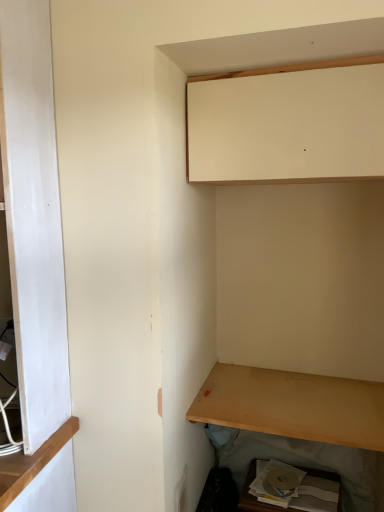
Question: Considering the relative sizes of matte white cabinet at upper center, the 1th cabinetry viewed from the top, and matte cardboard box at lower right, placed as the 1th cabinetry when sorted from bottom to top, in the image provided, is matte white cabinet at upper center, the 1th cabinetry viewed from the top, shorter than matte cardboard box at lower right, placed as the 1th cabinetry when sorted from bottom to top,?

Choices:
 (A) no
 (B) yes

Answer: (A)

Question: Can you confirm if matte white cabinet at upper center, the 1th cabinetry viewed from the top, is wider than matte cardboard box at lower right, acting as the 2th cabinetry starting from the top?

Choices:
 (A) no
 (B) yes

Answer: (B)

Question: From the image's perspective, is matte white cabinet at upper center, the 1th cabinetry viewed from the top, located beneath matte cardboard box at lower right, placed as the 1th cabinetry when sorted from bottom to top?

Choices:
 (A) no
 (B) yes

Answer: (A)

Question: Is matte white cabinet at upper center, the 1th cabinetry viewed from the top, located outside matte cardboard box at lower right, placed as the 1th cabinetry when sorted from bottom to top?

Choices:
 (A) yes
 (B) no

Answer: (A)

Question: Does matte white cabinet at upper center, which is the second cabinetry in bottom-to-top order, appear on the right side of matte cardboard box at lower right, placed as the 1th cabinetry when sorted from bottom to top?

Choices:
 (A) no
 (B) yes

Answer: (A)

Question: In terms of size, does light brown wood shelf at lower right appear bigger or smaller than matte cardboard box at lower right, acting as the 2th cabinetry starting from the top?

Choices:
 (A) big
 (B) small

Answer: (B)

Question: Is light brown wood shelf at lower right inside the boundaries of matte cardboard box at lower right, placed as the 1th cabinetry when sorted from bottom to top, or outside?

Choices:
 (A) inside
 (B) outside

Answer: (B)

Question: From a real-world perspective, is light brown wood shelf at lower right positioned above or below matte cardboard box at lower right, placed as the 1th cabinetry when sorted from bottom to top?

Choices:
 (A) above
 (B) below

Answer: (A)

Question: Based on their positions, is light brown wood shelf at lower right located to the left or right of matte cardboard box at lower right, acting as the 2th cabinetry starting from the top?

Choices:
 (A) right
 (B) left

Answer: (B)

Question: Relative to matte white cabinet at upper center, the 1th cabinetry viewed from the top, is matte cardboard box at lower right, acting as the 2th cabinetry starting from the top, in front or behind?

Choices:
 (A) front
 (B) behind

Answer: (B)

Question: Is matte cardboard box at lower right, placed as the 1th cabinetry when sorted from bottom to top, situated inside matte white cabinet at upper center, which is the second cabinetry in bottom-to-top order, or outside?

Choices:
 (A) outside
 (B) inside

Answer: (A)

Question: In terms of width, does matte cardboard box at lower right, acting as the 2th cabinetry starting from the top, look wider or thinner when compared to matte white cabinet at upper center, the 1th cabinetry viewed from the top?

Choices:
 (A) wide
 (B) thin

Answer: (B)

Question: In terms of size, does matte cardboard box at lower right, acting as the 2th cabinetry starting from the top, appear bigger or smaller than matte white cabinet at upper center, which is the second cabinetry in bottom-to-top order?

Choices:
 (A) small
 (B) big

Answer: (A)

Question: Considering the positions of point (193, 417) and point (382, 117), is point (193, 417) closer or farther from the camera than point (382, 117)?

Choices:
 (A) farther
 (B) closer

Answer: (A)

Question: Relative to matte white cabinet at upper center, which is the second cabinetry in bottom-to-top order, is light brown wood shelf at lower right in front or behind?

Choices:
 (A) behind
 (B) front

Answer: (A)